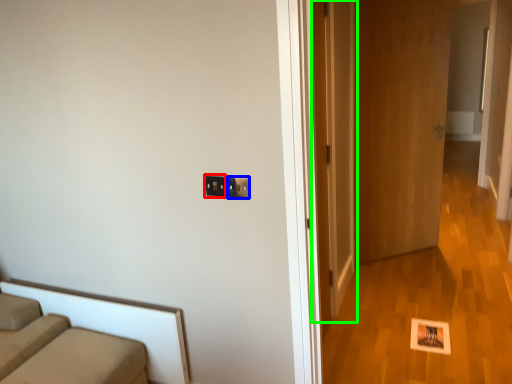
Question: Estimate the real-world distances between objects in this image. Which object is farther from electric outlet (highlighted by a red box), electric outlet (highlighted by a blue box) or door (highlighted by a green box)?

Choices:
 (A) electric outlet
 (B) door

Answer: (B)